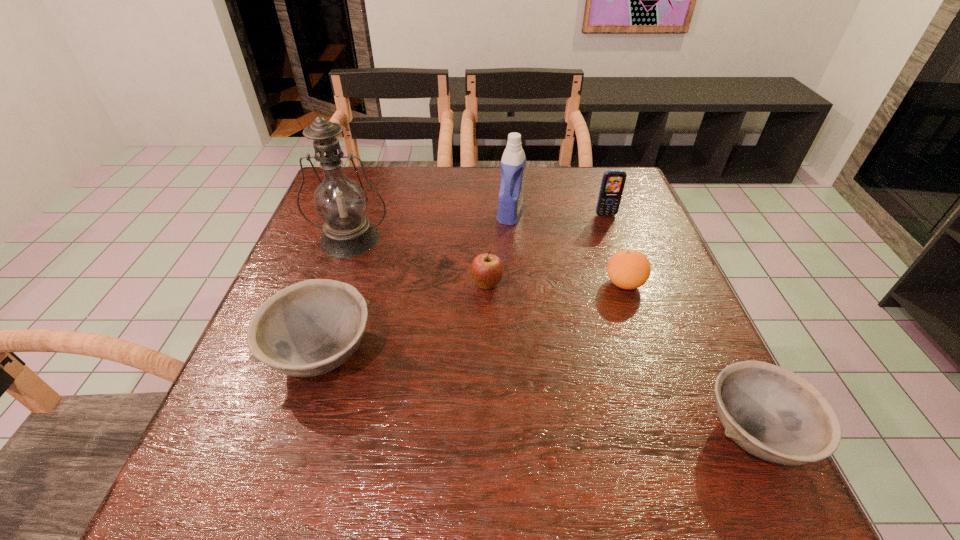
Locate an element on the screen. object that is at the near left corner is located at coordinates (310, 328).

This screenshot has width=960, height=540. I want to click on object that is at the near right corner, so click(x=772, y=413).

Where is `vacant space at the far edge`? The image size is (960, 540). vacant space at the far edge is located at coordinates (492, 196).

At what (x,y) coordinates should I click in order to perform the action: click on vacant space at the near edge. Please return your answer as a coordinate pair (x, y). The height and width of the screenshot is (540, 960). Looking at the image, I should click on (318, 404).

Image resolution: width=960 pixels, height=540 pixels. In order to click on vacant space at the left edge in this screenshot , I will do `click(288, 286)`.

I want to click on vacant region at the right edge of the desktop, so click(x=689, y=326).

In the image, there is a desktop. Where is `free space at the far left corner`? The width and height of the screenshot is (960, 540). free space at the far left corner is located at coordinates (377, 193).

I want to click on blank region between the detergent and the apple, so click(498, 249).

Where is `empty space that is in between the cellular telephone and the apple`? empty space that is in between the cellular telephone and the apple is located at coordinates (546, 250).

Locate an element on the screen. The width and height of the screenshot is (960, 540). free space between the tallest object and the right bowl is located at coordinates (552, 336).